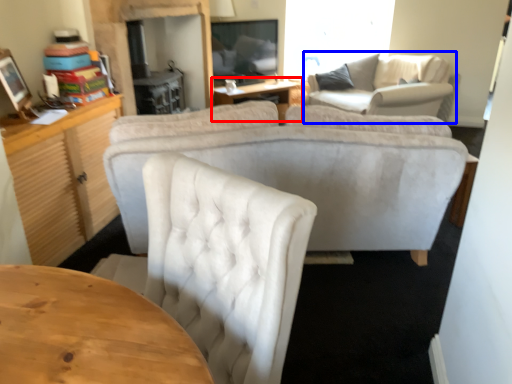
Question: Among these objects, which one is nearest to the camera, table (highlighted by a red box) or couch (highlighted by a blue box)?

Choices:
 (A) table
 (B) couch

Answer: (B)